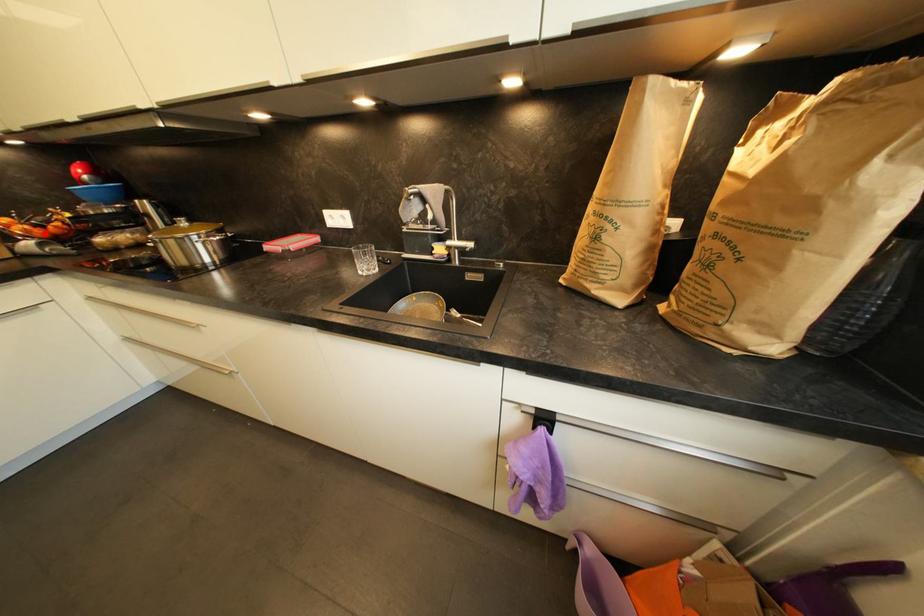
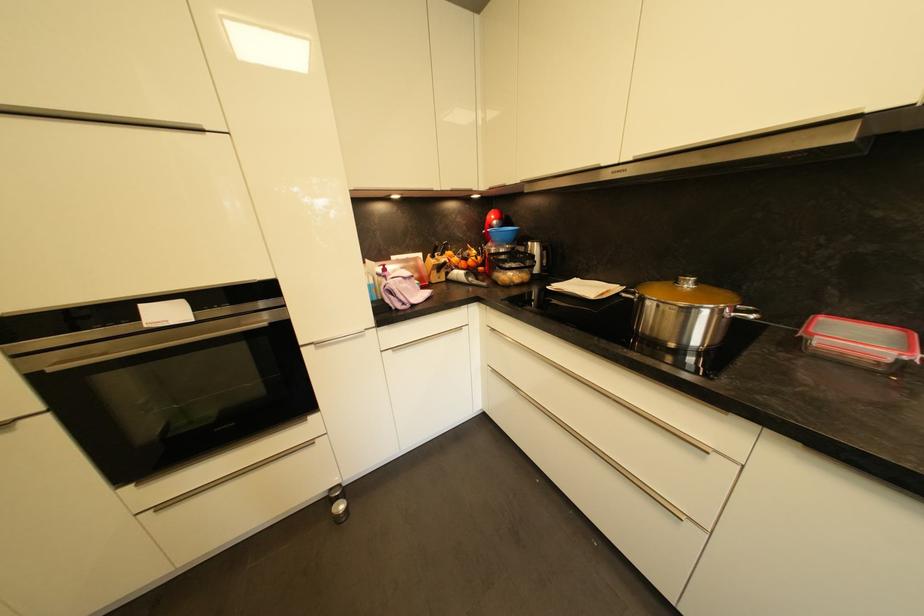
In the second image, find the point that corresponds to the highlighted location in the first image.

(468, 265)